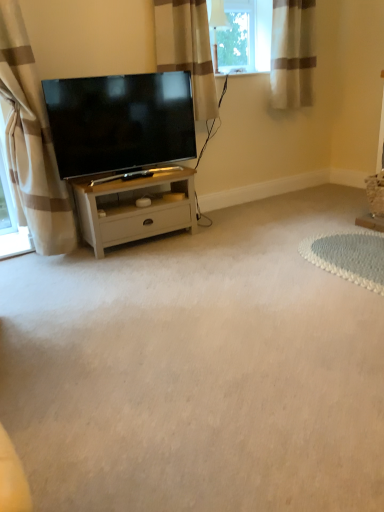
Locate an element on the screen. Image resolution: width=384 pixels, height=512 pixels. unoccupied region to the right of white wood cabinet at center is located at coordinates (222, 241).